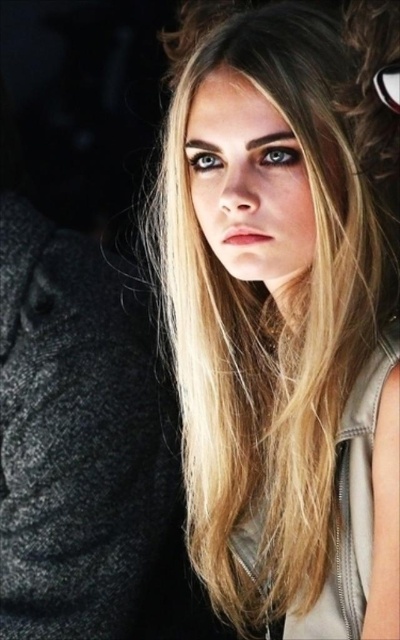
Can you confirm if blonde hair at center is positioned to the left of black plastic goggles at upper right?

Correct, you'll find blonde hair at center to the left of black plastic goggles at upper right.

What do you see at coordinates (266, 301) in the screenshot? I see `blonde hair at center` at bounding box center [266, 301].

Where is `blonde hair at center`? blonde hair at center is located at coordinates pos(266,301).